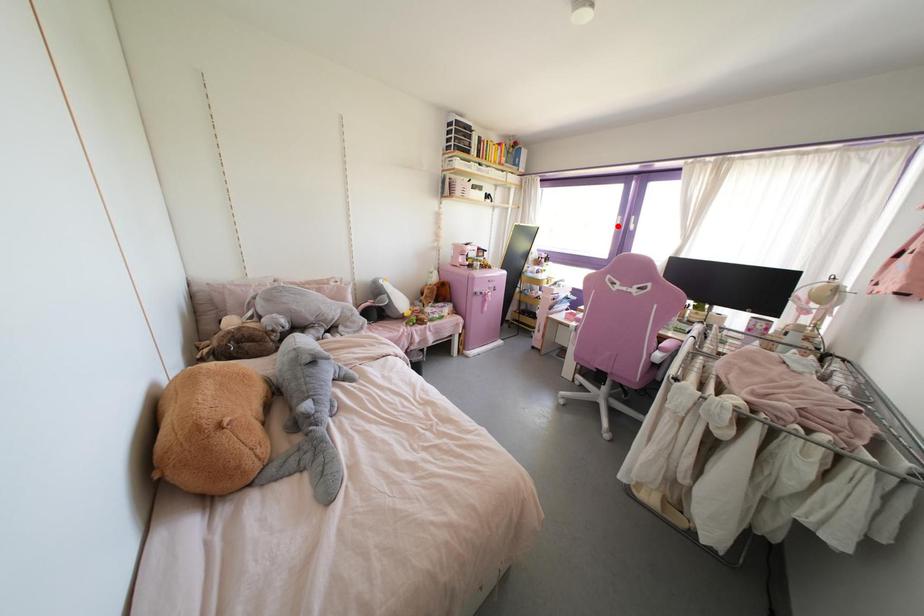
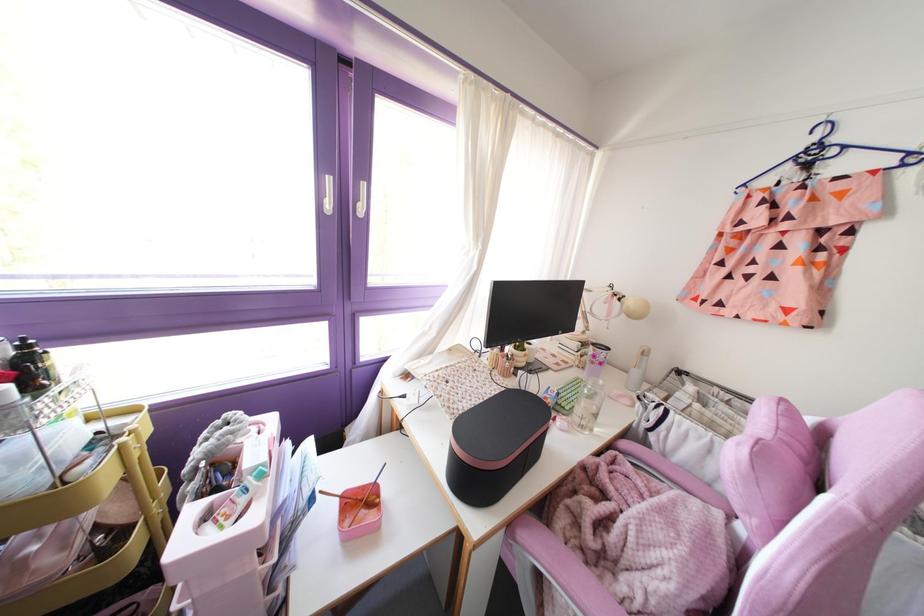
Locate, in the second image, the point that corresponds to the highlighted location in the first image.

(329, 205)